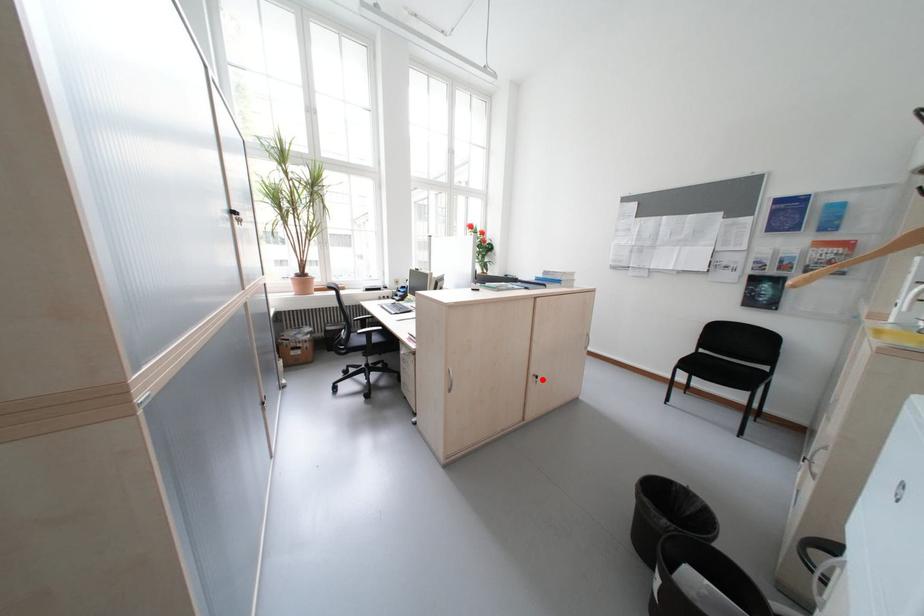
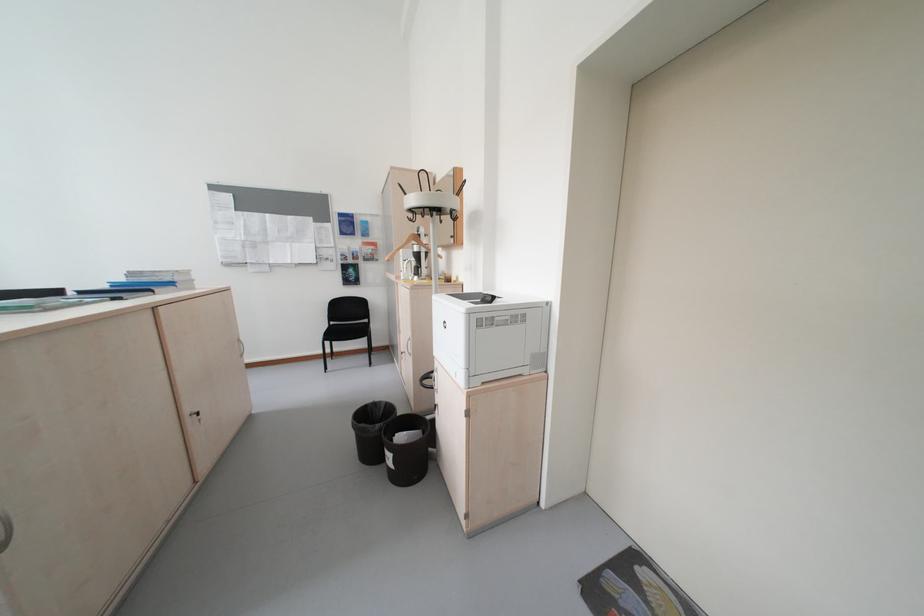
In the second image, find the point that corresponds to the highlighted location in the first image.

(200, 421)